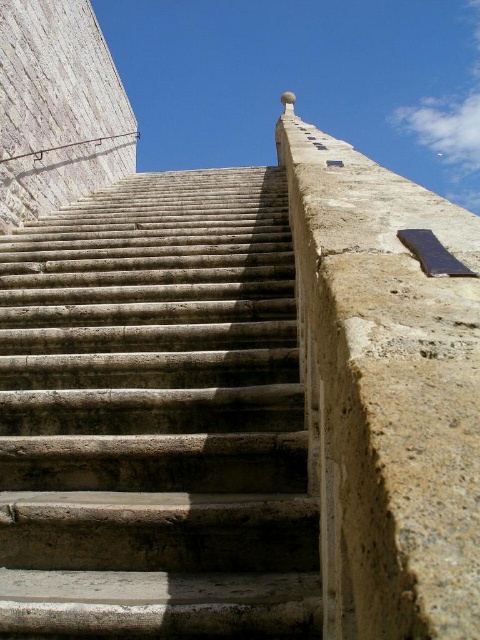
Which is more to the right, smooth beige concrete at right or smooth beige concrete at upper left?

smooth beige concrete at right

Does smooth beige concrete at right appear over smooth beige concrete at upper left?

Actually, smooth beige concrete at right is below smooth beige concrete at upper left.

Where is `smooth beige concrete at right`? Image resolution: width=480 pixels, height=640 pixels. smooth beige concrete at right is located at coordinates (385, 392).

Which is more to the right, gray stone stairs at center or smooth beige concrete at upper left?

gray stone stairs at center is more to the right.

Between point (90, 301) and point (3, 74), which one is positioned behind?

The point (3, 74) is more distant.

Identify the location of gray stone stairs at center. The image size is (480, 640). (156, 417).

In the scene shown: Can you confirm if gray stone stairs at center is positioned above smooth beige concrete at right?

No.

The width and height of the screenshot is (480, 640). Describe the element at coordinates (156, 417) in the screenshot. I see `gray stone stairs at center` at that location.

Identify the location of gray stone stairs at center. The height and width of the screenshot is (640, 480). (156, 417).

You are a GUI agent. You are given a task and a screenshot of the screen. Output one action in this format:
    pyautogui.click(x=<x>, y=<y>)
    Task: Click on the gray stone stairs at center
    This screenshot has height=640, width=480.
    Given the screenshot: What is the action you would take?
    pyautogui.click(x=156, y=417)